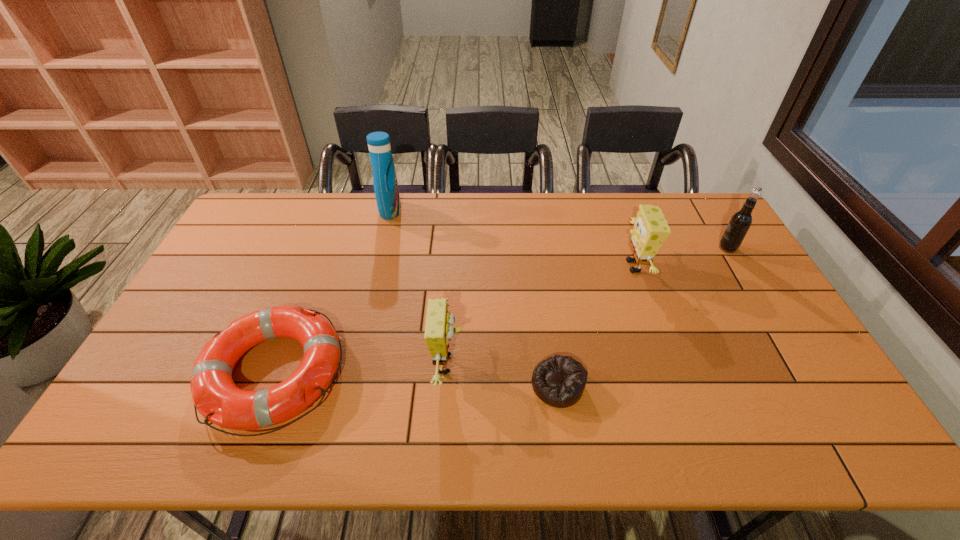
I want to click on free space located 0.050m on the front-facing side of the farthest object, so click(x=415, y=211).

Locate an element on the screen. The image size is (960, 540). vacant region located 0.080m on the label of the root beer is located at coordinates pyautogui.click(x=694, y=248).

Locate an element on the screen. This screenshot has width=960, height=540. blank space located 0.130m on the label of the root beer is located at coordinates (680, 248).

Where is `free space located on the label of the root beer`? The height and width of the screenshot is (540, 960). free space located on the label of the root beer is located at coordinates (683, 248).

Where is `free spot located on the face of the farther sponge`? Image resolution: width=960 pixels, height=540 pixels. free spot located on the face of the farther sponge is located at coordinates (548, 266).

Where is `blank space located 0.110m on the face of the farther sponge`? This screenshot has height=540, width=960. blank space located 0.110m on the face of the farther sponge is located at coordinates (586, 266).

Image resolution: width=960 pixels, height=540 pixels. In order to click on vacant region located 0.230m on the face of the farther sponge in this screenshot , I will do coord(548,266).

Where is `vacant space located 0.390m on the face of the left sponge`? The image size is (960, 540). vacant space located 0.390m on the face of the left sponge is located at coordinates (612, 363).

Find the location of a particular element. The width and height of the screenshot is (960, 540). free space located 0.350m on the right of the life buoy is located at coordinates (479, 373).

What are the coordinates of `vacant space located 0.300m on the back of the beanbag` in the screenshot? It's located at (543, 281).